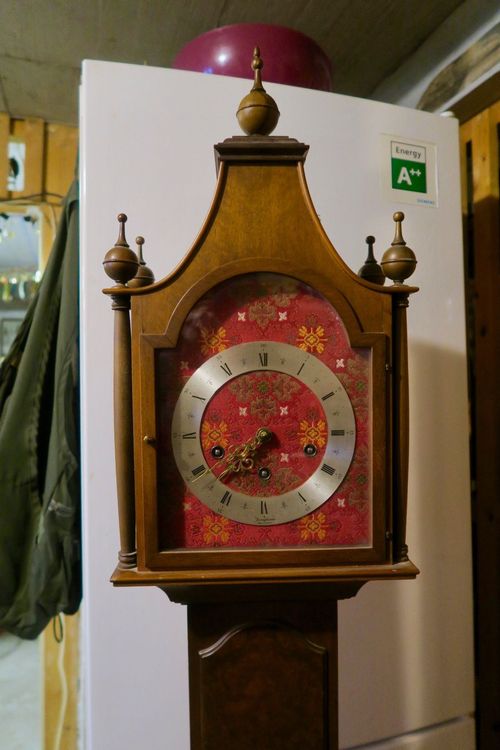
In order to click on back walls in this screenshot , I will do `click(60, 171)`, `click(464, 76)`, `click(483, 192)`.